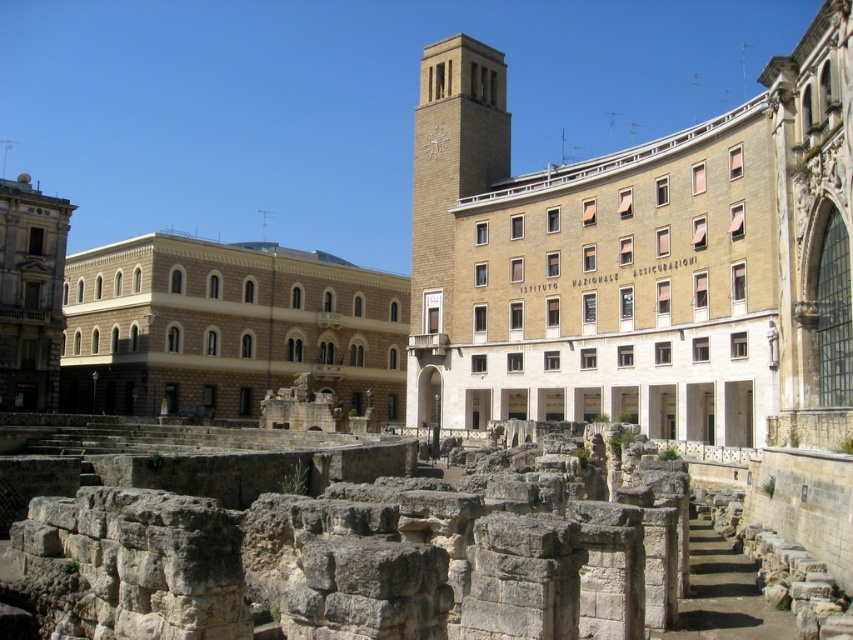
Question: Is brown stone amphitheater at center behind beige stone clock tower at center?

Choices:
 (A) yes
 (B) no

Answer: (A)

Question: Considering the relative positions of brown stone amphitheater at center and beige stone clock tower at center in the image provided, where is brown stone amphitheater at center located with respect to beige stone clock tower at center?

Choices:
 (A) below
 (B) above

Answer: (A)

Question: Is brown stone amphitheater at center thinner than beige stone clock tower at center?

Choices:
 (A) no
 (B) yes

Answer: (A)

Question: Among these points, which one is farthest from the camera?

Choices:
 (A) [x=260, y=250]
 (B) [x=422, y=272]

Answer: (A)